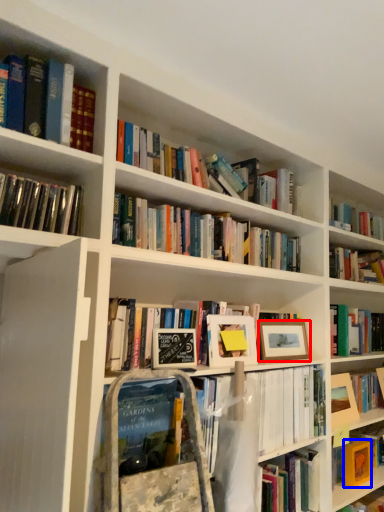
Question: Which point is closer to the camera, picture frame (highlighted by a red box) or paperback book (highlighted by a blue box)?

Choices:
 (A) picture frame
 (B) paperback book

Answer: (A)